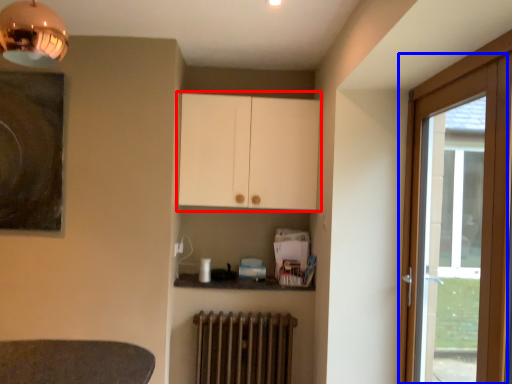
Question: Which of the following is the farthest to the observer, cabinetry (highlighted by a red box) or door (highlighted by a blue box)?

Choices:
 (A) cabinetry
 (B) door

Answer: (A)